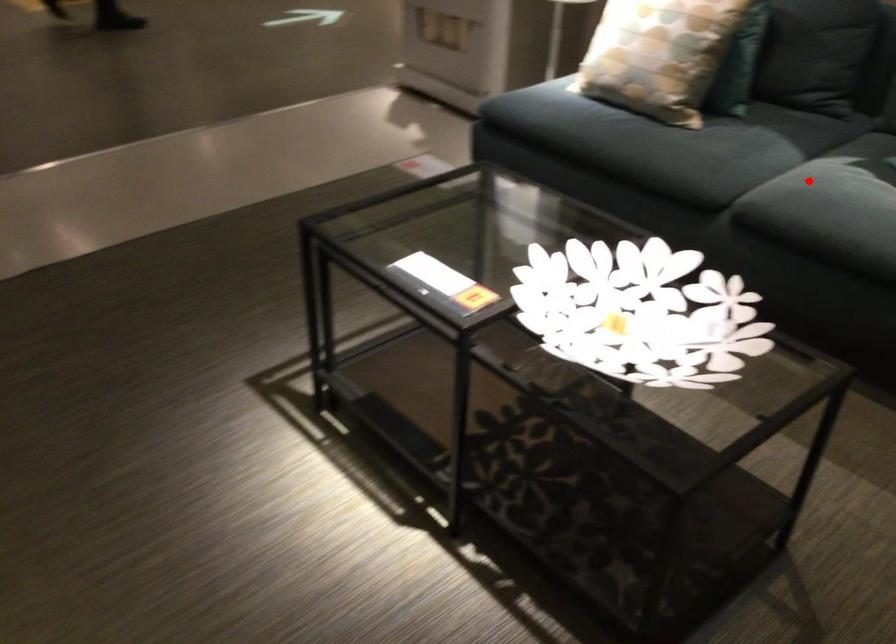
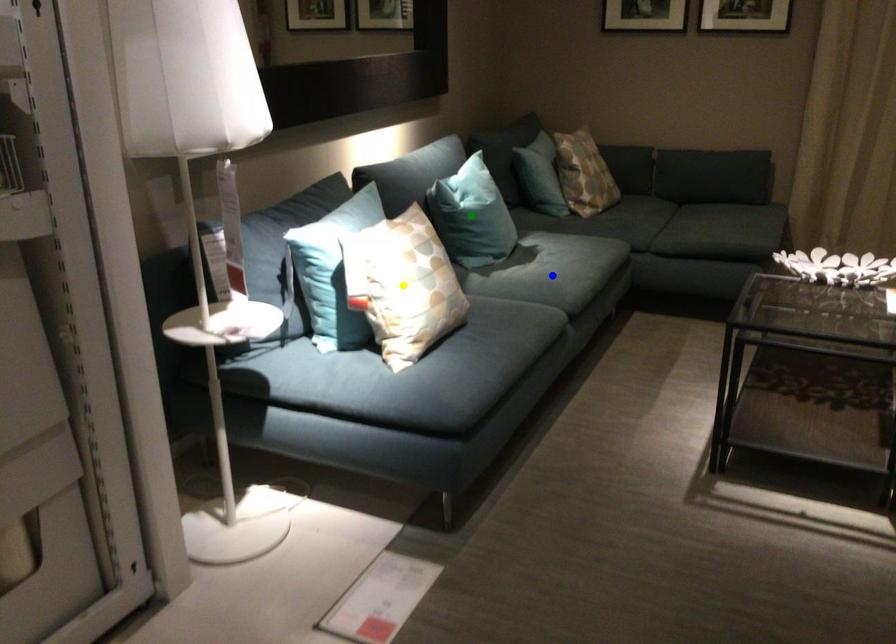
Question: I am providing you with two images of the same scene from different viewpoints. A red point is marked on the first image. You are given multiple points on the second image. Which point in image 2 is actually the same real-world point as the red point in image 1?

Choices:
 (A) blue point
 (B) yellow point
 (C) green point

Answer: (A)